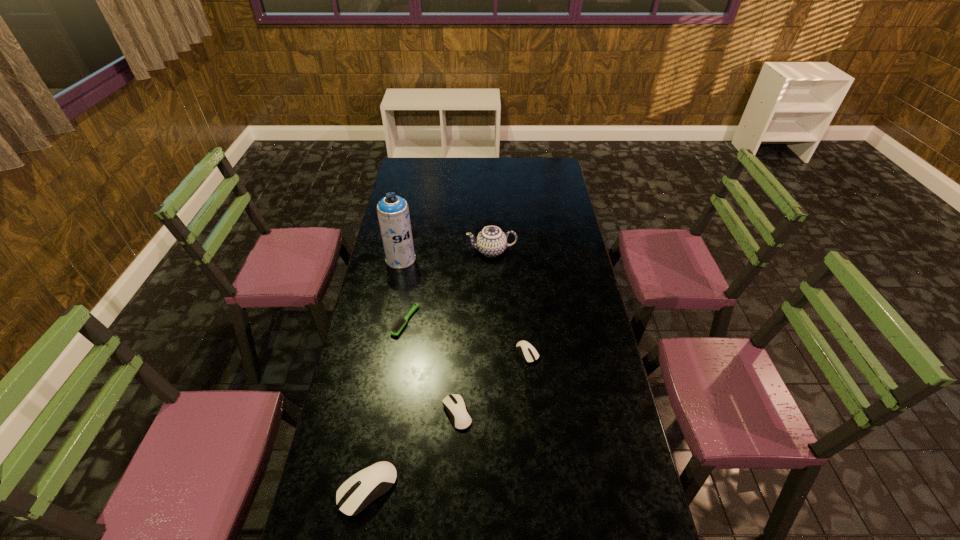
At what (x,y) coordinates should I click in order to perform the action: click on free point between the second mouse from right to left and the second tallest object. Please return your answer as a coordinate pair (x, y). The width and height of the screenshot is (960, 540). Looking at the image, I should click on (474, 332).

Where is `vacant area between the aerosol can and the second farthest mouse`? The height and width of the screenshot is (540, 960). vacant area between the aerosol can and the second farthest mouse is located at coordinates (429, 336).

At what (x,y) coordinates should I click in order to perform the action: click on vacant area that lies between the rightmost mouse and the hairbrush. Please return your answer as a coordinate pair (x, y). Image resolution: width=960 pixels, height=540 pixels. Looking at the image, I should click on (467, 337).

At what (x,y) coordinates should I click in order to perform the action: click on unoccupied position between the chinaware and the leftmost mouse. Please return your answer as a coordinate pair (x, y). This screenshot has height=540, width=960. Looking at the image, I should click on (429, 370).

Find the location of `empty location between the nearest mouse and the fifth farthest object`. empty location between the nearest mouse and the fifth farthest object is located at coordinates 412,451.

At what (x,y) coordinates should I click in order to perform the action: click on vacant area that lies between the aerosol can and the leftmost mouse. Please return your answer as a coordinate pair (x, y). The width and height of the screenshot is (960, 540). Looking at the image, I should click on (384, 374).

Where is `free space between the shortest mouse and the third farthest object`? This screenshot has height=540, width=960. free space between the shortest mouse and the third farthest object is located at coordinates (467, 337).

Find the location of a particular element. free space that is in between the second tallest mouse and the fourth shortest object is located at coordinates (412, 451).

Identify which object is the fourth nearest to the third shortest object. Please provide its 2D coordinates. Your answer should be formatted as a tuple, i.e. [(x, y)], where the tuple contains the x and y coordinates of a point satisfying the conditions above.

[(393, 212)]

This screenshot has width=960, height=540. Identify the location of object identified as the closest to the tallest object. (400, 324).